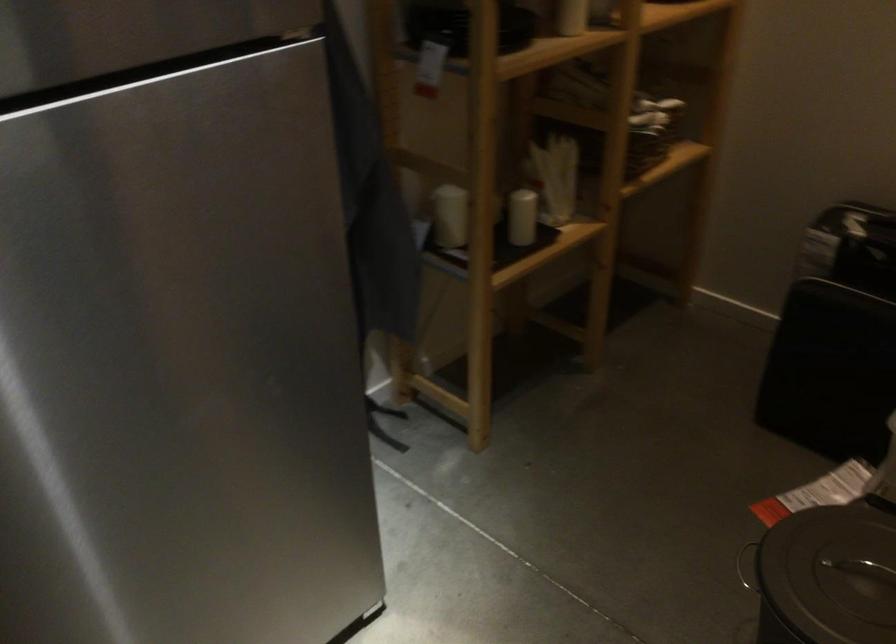
Image resolution: width=896 pixels, height=644 pixels. In order to click on trash can lid in this screenshot , I will do pyautogui.click(x=828, y=576).